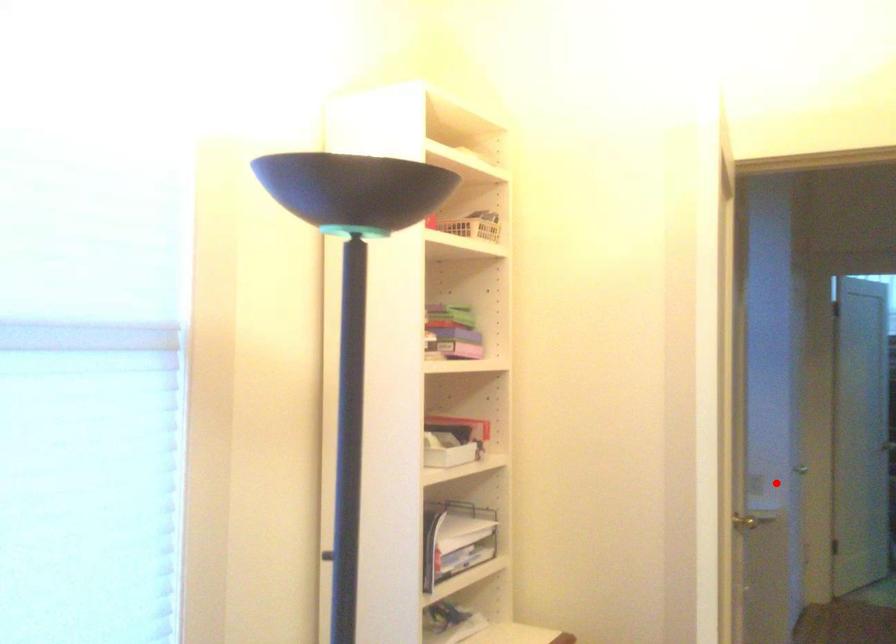
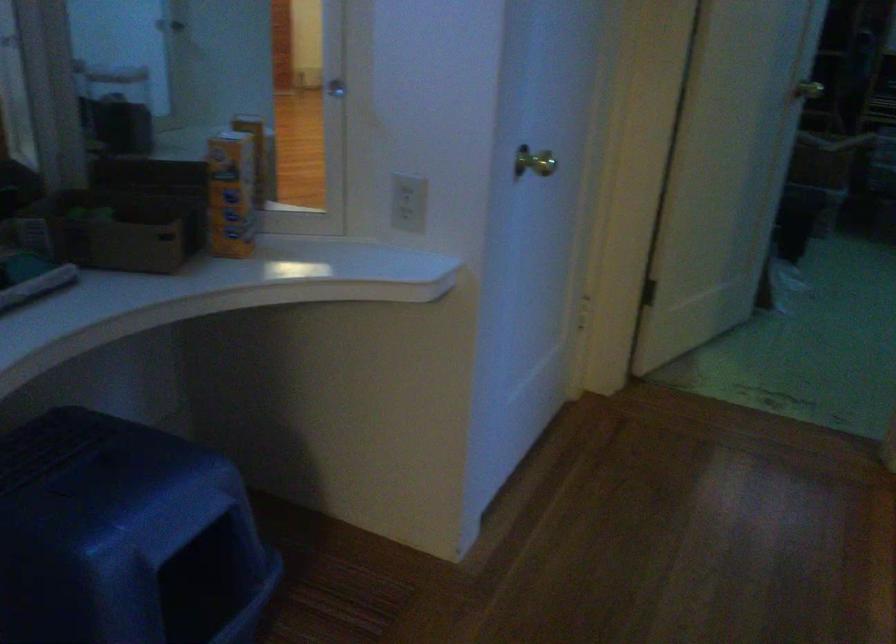
The point at the highlighted location is marked in the first image. Where is the corresponding point in the second image?

(409, 202)